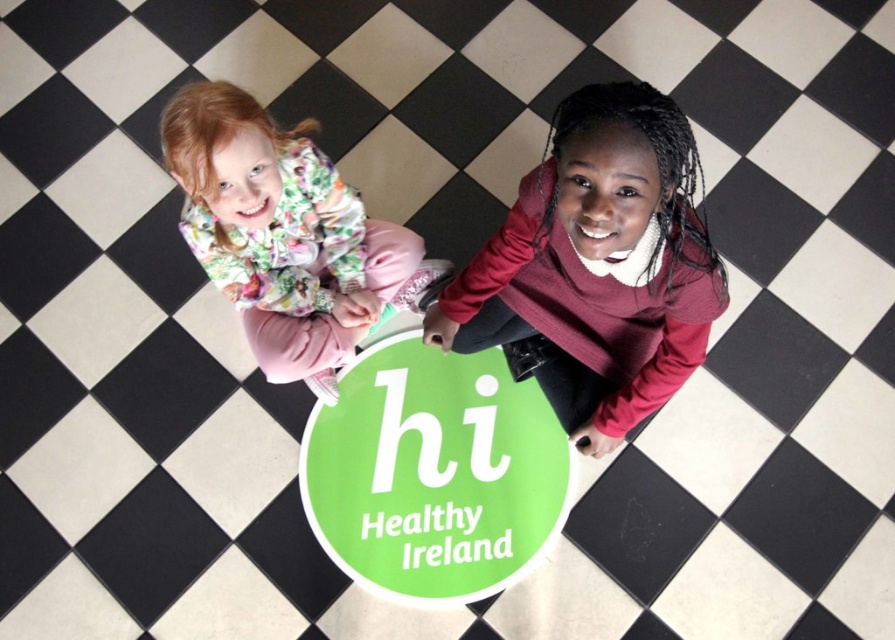
Question: In this image, where is green matte sign at center located relative to floral fabric jacket at upper left?

Choices:
 (A) below
 (B) above

Answer: (A)

Question: Which point is farther from the camera taking this photo?

Choices:
 (A) (688, 305)
 (B) (260, 248)

Answer: (B)

Question: Among these points, which one is nearest to the camera?

Choices:
 (A) (301, 147)
 (B) (311, 433)

Answer: (A)

Question: Does green matte sign at center have a greater width compared to floral fabric jacket at upper left?

Choices:
 (A) no
 (B) yes

Answer: (B)

Question: Is maroon sweater at center to the right of floral fabric jacket at upper left from the viewer's perspective?

Choices:
 (A) no
 (B) yes

Answer: (B)

Question: Which point is farther from the camera taking this photo?

Choices:
 (A) (544, 296)
 (B) (521, 454)

Answer: (B)